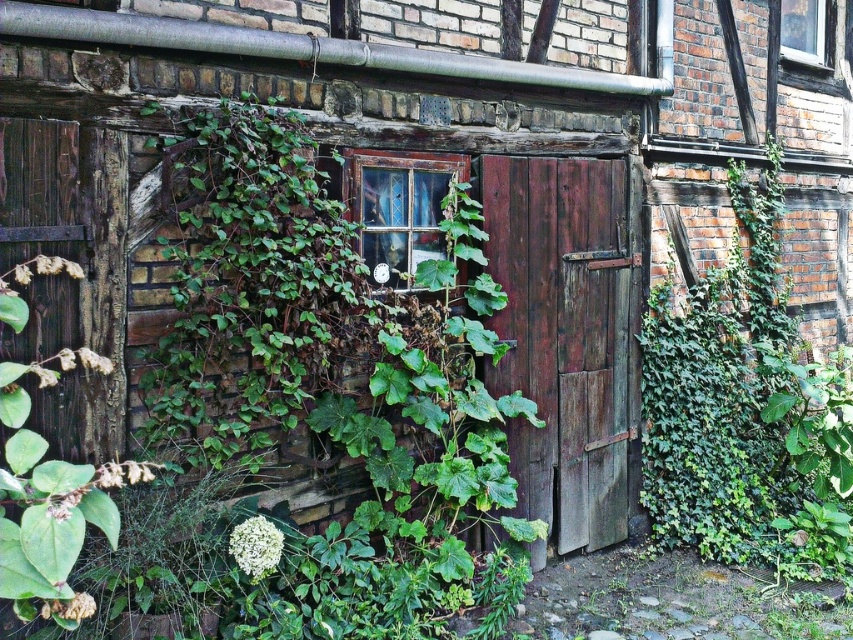
Question: Does translucent glass window at center have a larger size compared to clear glass window at upper right?

Choices:
 (A) yes
 (B) no

Answer: (B)

Question: Which of these objects is positioned farthest from the translucent glass window at center?

Choices:
 (A) clear glass window at upper right
 (B) weathered wood door at center

Answer: (A)

Question: Estimate the real-world distances between objects in this image. Which object is farther from the weathered wood door at center?

Choices:
 (A) translucent glass window at center
 (B) clear glass window at upper right

Answer: (B)

Question: Can you confirm if weathered wood door at center is positioned above translucent glass window at center?

Choices:
 (A) no
 (B) yes

Answer: (A)

Question: Among these points, which one is farthest from the camera?

Choices:
 (A) (427, 166)
 (B) (804, 36)
 (C) (619, 490)

Answer: (B)

Question: Does translucent glass window at center have a lesser width compared to clear glass window at upper right?

Choices:
 (A) no
 (B) yes

Answer: (B)